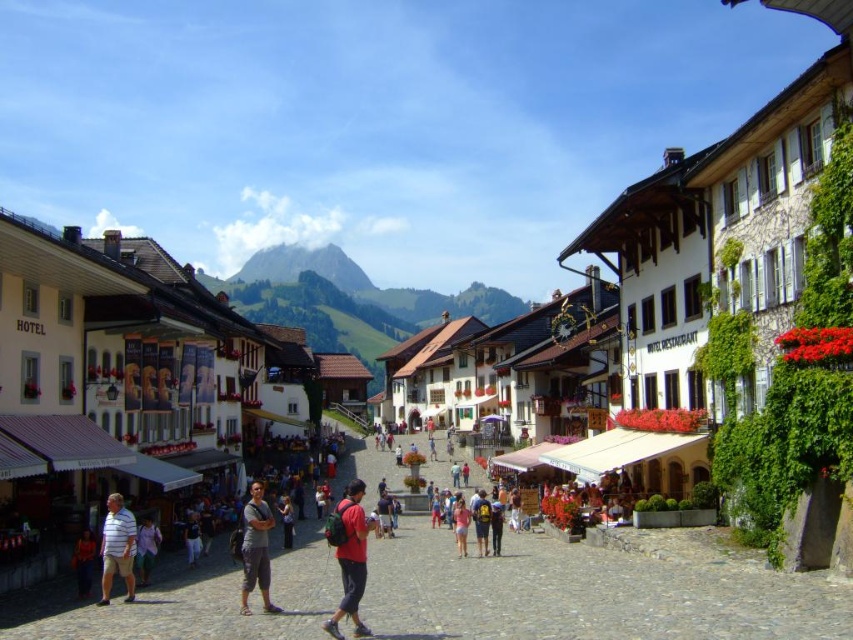
Question: Does matte red backpack at center come in front of gray cotton pants at center?

Choices:
 (A) no
 (B) yes

Answer: (B)

Question: Estimate the real-world distances between objects in this image. Which object is closer to the dark blue backpack at center?

Choices:
 (A) striped cotton shirt at center
 (B) matte red backpack at center

Answer: (B)

Question: Among these objects, which one is farthest from the camera?

Choices:
 (A) striped cotton shirt at center
 (B) pink fabric shorts at center

Answer: (B)

Question: Is gray cotton pants at center smaller than pink fabric shorts at center?

Choices:
 (A) yes
 (B) no

Answer: (B)

Question: Among these points, which one is farthest from the camera?

Choices:
 (A) (260, 561)
 (B) (343, 566)
 (C) (463, 500)
 (D) (483, 550)

Answer: (C)

Question: Can you confirm if dark blue backpack at center is positioned to the left of pink fabric shorts at center?

Choices:
 (A) no
 (B) yes

Answer: (A)